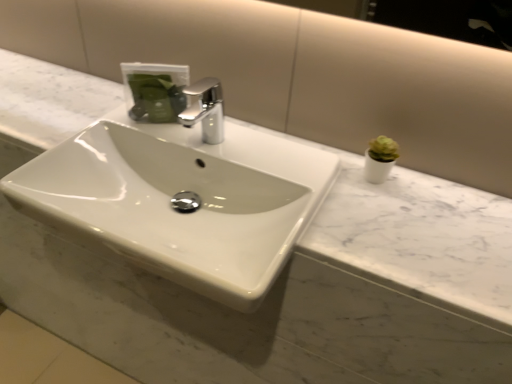
Find the location of a particular element. The width and height of the screenshot is (512, 384). white glossy sink at center is located at coordinates (174, 197).

What do you see at coordinates (174, 197) in the screenshot?
I see `white glossy sink at center` at bounding box center [174, 197].

Measure the distance between chrome metallic faucet at center and camera.

36.87 inches.

At what (x,y) coordinates should I click in order to perform the action: click on chrome metallic faucet at center. Please return your answer as a coordinate pair (x, y). The width and height of the screenshot is (512, 384). Looking at the image, I should click on (205, 109).

What is the approximate height of chrome metallic faucet at center?

chrome metallic faucet at center is 5.10 inches in height.

The width and height of the screenshot is (512, 384). Describe the element at coordinates (205, 109) in the screenshot. I see `chrome metallic faucet at center` at that location.

In order to click on white glossy sink at center in this screenshot , I will do `click(174, 197)`.

Considering the relative positions of white glossy sink at center and chrome metallic faucet at center in the image provided, is white glossy sink at center to the left or to the right of chrome metallic faucet at center?

In the image, white glossy sink at center appears on the left side of chrome metallic faucet at center.

In the image, is white glossy sink at center positioned in front of or behind chrome metallic faucet at center?

white glossy sink at center is in front of chrome metallic faucet at center.

Between point (131, 177) and point (214, 81), which one is positioned in front?

The point (131, 177) is more forward.

From the image's perspective, is white glossy sink at center on top of chrome metallic faucet at center?

No, from the image's perspective, white glossy sink at center is not over chrome metallic faucet at center.

From a real-world perspective, is white glossy sink at center on top of chrome metallic faucet at center?

Actually, white glossy sink at center is physically below chrome metallic faucet at center in the real world.

Is white glossy sink at center wider than chrome metallic faucet at center?

Yes.

Considering the sizes of objects white glossy sink at center and chrome metallic faucet at center in the image provided, who is shorter, white glossy sink at center or chrome metallic faucet at center?

With less height is chrome metallic faucet at center.

In terms of size, does white glossy sink at center appear bigger or smaller than chrome metallic faucet at center?

Clearly, white glossy sink at center is larger in size than chrome metallic faucet at center.

Is white glossy sink at center not within chrome metallic faucet at center?

Yes, white glossy sink at center is outside of chrome metallic faucet at center.

Would you consider white glossy sink at center to be distant from chrome metallic faucet at center?

white glossy sink at center is actually quite close to chrome metallic faucet at center.

Is white glossy sink at center oriented towards chrome metallic faucet at center?

No, white glossy sink at center does not turn towards chrome metallic faucet at center.

Consider the image. How different are the orientations of white glossy sink at center and chrome metallic faucet at center in degrees?

There is a 1.87-degree angle between the facing directions of white glossy sink at center and chrome metallic faucet at center.

At what (x,y) coordinates should I click in order to perform the action: click on sink in front of the chrome metallic faucet at center. Please return your answer as a coordinate pair (x, y). Looking at the image, I should click on (174, 197).

Between chrome metallic faucet at center and white glossy sink at center, which one appears on the left side from the viewer's perspective?

From the viewer's perspective, white glossy sink at center appears more on the left side.

In the scene shown: Which object is closer to the camera, chrome metallic faucet at center or white glossy sink at center?

white glossy sink at center is closer to the camera.

Which is behind, point (207, 77) or point (114, 143)?

The point (207, 77) is farther from the camera.

In the scene shown: From the image's perspective, between chrome metallic faucet at center and white glossy sink at center, who is located below?

white glossy sink at center is shown below in the image.

From a real-world perspective, is chrome metallic faucet at center physically located above or below white glossy sink at center?

Clearly, from a real-world perspective, chrome metallic faucet at center is above white glossy sink at center.

In terms of width, does chrome metallic faucet at center look wider or thinner when compared to white glossy sink at center?

chrome metallic faucet at center is thinner than white glossy sink at center.

In terms of height, does chrome metallic faucet at center look taller or shorter compared to white glossy sink at center?

Considering their sizes, chrome metallic faucet at center has less height than white glossy sink at center.

Considering the relative sizes of chrome metallic faucet at center and white glossy sink at center in the image provided, is chrome metallic faucet at center bigger than white glossy sink at center?

No.

Is white glossy sink at center completely or partially inside chrome metallic faucet at center?

No, chrome metallic faucet at center does not contain white glossy sink at center.

Based on the photo, is chrome metallic faucet at center in contact with white glossy sink at center?

No, chrome metallic faucet at center is not touching white glossy sink at center.

In the scene shown: Is chrome metallic faucet at center looking in the opposite direction of white glossy sink at center?

No.

Can you tell me how much chrome metallic faucet at center and white glossy sink at center differ in facing direction?

They differ by 1.87 degrees in their facing directions.

Where is `tap above the white glossy sink at center (from the image's perspective)`? tap above the white glossy sink at center (from the image's perspective) is located at coordinates (205, 109).

This screenshot has height=384, width=512. I want to click on tap that is above the white glossy sink at center (from the image's perspective), so click(x=205, y=109).

Identify the location of sink that appears on the left of chrome metallic faucet at center. (174, 197).